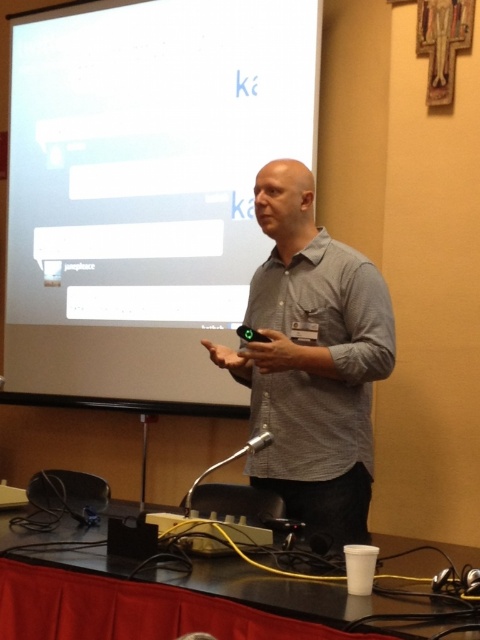
Question: In this image, where is white matte projection screen at upper center located relative to yellow cable at lower center?

Choices:
 (A) right
 (B) left

Answer: (B)

Question: Based on their relative distances, which object is farther from the white matte projection screen at upper center?

Choices:
 (A) yellow cable at lower center
 (B) metallic silver microphone at lower center

Answer: (A)

Question: Which point is farther from the camera taking this photo?

Choices:
 (A) (x=159, y=532)
 (B) (x=303, y=186)

Answer: (B)

Question: Among these objects, which one is farthest from the camera?

Choices:
 (A) metallic silver microphone at lower center
 (B) white matte projection screen at upper center

Answer: (A)

Question: Can you confirm if white matte projection screen at upper center is thinner than gray checkered shirt at center?

Choices:
 (A) yes
 (B) no

Answer: (B)

Question: Does white matte projection screen at upper center appear under metallic silver microphone at lower center?

Choices:
 (A) yes
 (B) no

Answer: (B)